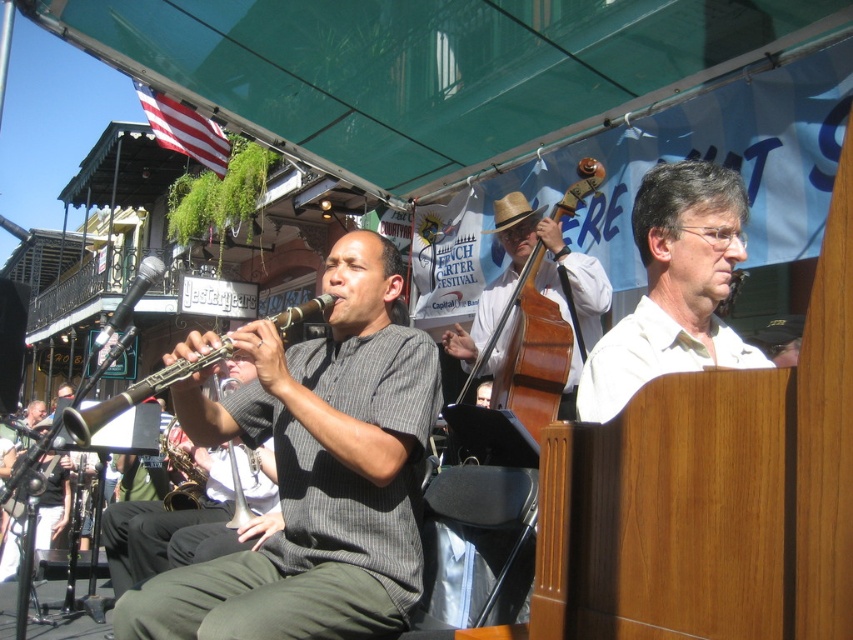
Is gray striped shirt at center to the right of wooden clarinet at center from the viewer's perspective?

Correct, you'll find gray striped shirt at center to the right of wooden clarinet at center.

Does gray striped shirt at center have a smaller size compared to wooden clarinet at center?

Correct, gray striped shirt at center occupies less space than wooden clarinet at center.

Is point (206, 433) positioned in front of point (146, 388)?

No.

What are the coordinates of `gray striped shirt at center` in the screenshot? It's located at (315, 472).

Is brown wooden cello at center positioned before wooden clarinet at center?

No, brown wooden cello at center is further to the viewer.

Is brown wooden cello at center above wooden clarinet at center?

Yes.

Does point (457, 337) come behind point (107, 397)?

No, (457, 337) is in front of (107, 397).

Image resolution: width=853 pixels, height=640 pixels. I want to click on brown wooden cello at center, so click(x=538, y=308).

Can you confirm if white matte shirt at center is bigger than brown wooden cello at center?

No, white matte shirt at center is not bigger than brown wooden cello at center.

From the picture: Who is more distant from viewer, (614,403) or (482,369)?

The point (482,369) is behind.

Measure the distance between point (692, 280) and camera.

Point (692, 280) is 6.82 feet from camera.

The height and width of the screenshot is (640, 853). In order to click on white matte shirt at center in this screenshot , I will do `click(674, 288)`.